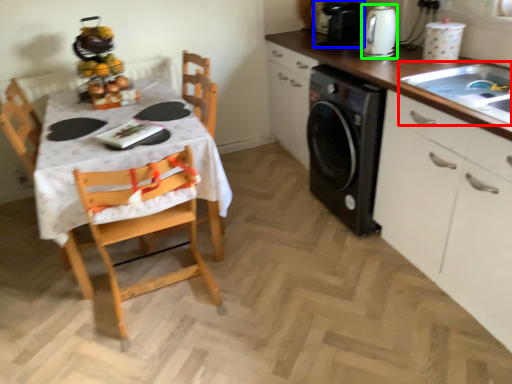
Question: Which is farther away from sink (highlighted by a red box)? appliance (highlighted by a blue box) or kitchen appliance (highlighted by a green box)?

Choices:
 (A) appliance
 (B) kitchen appliance

Answer: (A)